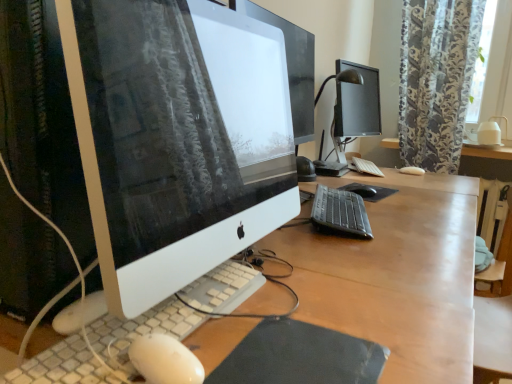
Identify the location of free space above wooden desk at center, placed as the 1th desk when sorted from left to right (from a real-world perspective). (376, 218).